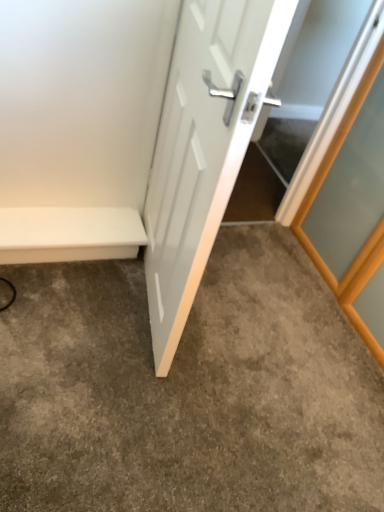
Where is `vacant area that lies to the right of white glossy door at center`? The height and width of the screenshot is (512, 384). vacant area that lies to the right of white glossy door at center is located at coordinates (256, 329).